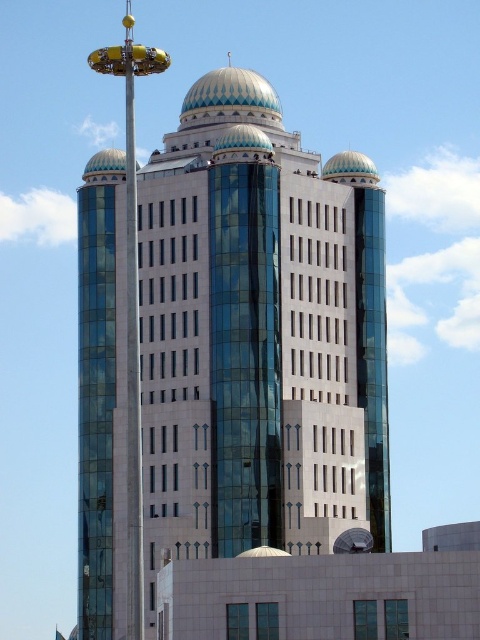
You are a maintenance worker needing to inspect the white glossy dome at upper center and the white glossy dome at center. The safety regulations state that you must maintain a minimum distance of 100 feet between inspection points to ensure structural integrity. Can you safely inspect both domes without violating the regulations?

The white glossy dome at upper center and white glossy dome at center are 114.75 feet apart from each other. Since this distance exceeds the required 100 feet minimum, you can safely inspect both domes without violating the safety regulations.

You are an architect planning to install a new light fixture on the roof of the building. The light fixture requires a minimum of 2 meters of clear space around it to function properly. Given the positions and sizes of the matte glass dome at center and the gold metallic dome at upper left, can you place the light fixture between them?

The matte glass dome at center is larger in size than the gold metallic dome at upper left. However, the exact distance between them is not provided, so it is uncertain if there is enough space for the light fixture requiring 2 meters of clear space around it. Further measurements are needed to confirm.

You are standing in front of the modern architectural structure and want to take a photo. You notice two points marked in the image at coordinates point [142,65] and point [192,108]. Which point is closer to your camera lens?

Point [142,65] is closer to the camera than point [192,108].